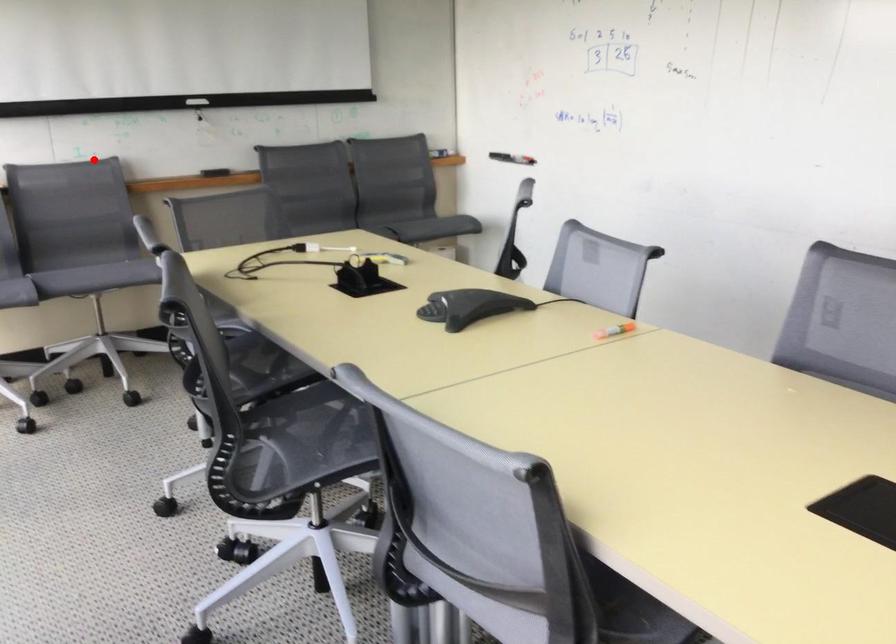
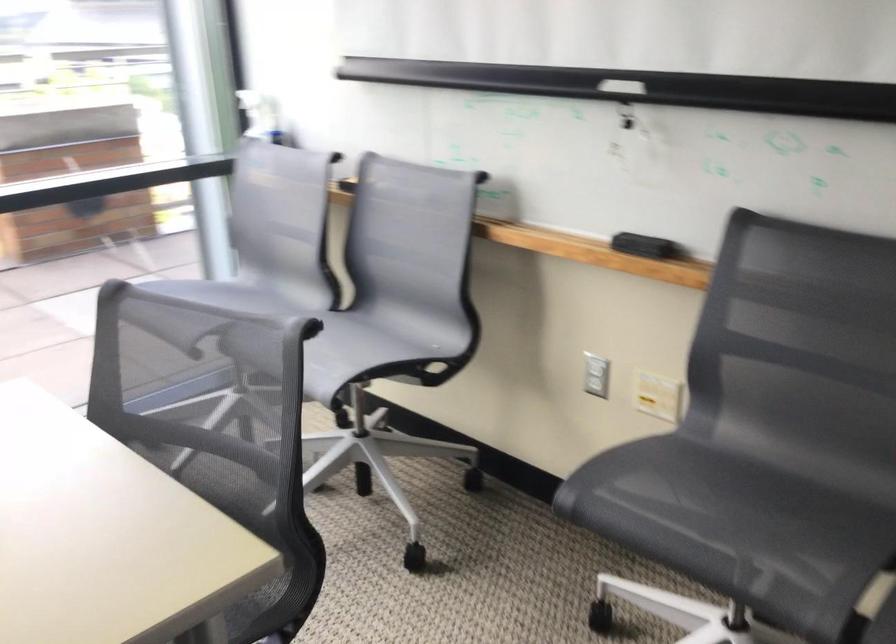
Find the pixel in the second image that matches the highlighted location in the first image.

(457, 182)